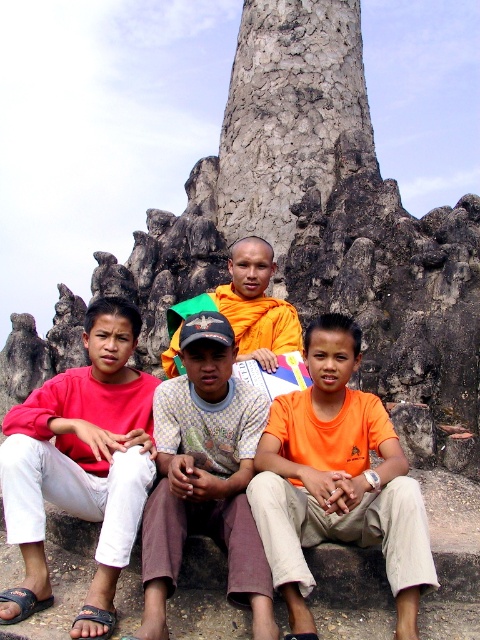
Which of these two, light brown cotton shirt at center or orange cloth at center, stands taller?

With more height is light brown cotton shirt at center.

Can you confirm if light brown cotton shirt at center is bigger than orange cloth at center?

No.

Where is `light brown cotton shirt at center`? light brown cotton shirt at center is located at coordinates (204, 476).

Image resolution: width=480 pixels, height=640 pixels. Identify the location of light brown cotton shirt at center. (204, 476).

How far apart are matte red shirt at left and orange cloth at center?

matte red shirt at left and orange cloth at center are 12.20 meters apart.

Is matte red shirt at left taller than orange cloth at center?

Indeed, matte red shirt at left has a greater height compared to orange cloth at center.

Is point (13, 456) less distant than point (277, 307)?

That is True.

Locate an element on the screen. The width and height of the screenshot is (480, 640). matte red shirt at left is located at coordinates (81, 465).

Identify the location of orange cotton shirt at center. This screenshot has width=480, height=640. (336, 481).

Is orange cotton shirt at center thinner than light brown cotton shirt at center?

No, orange cotton shirt at center is not thinner than light brown cotton shirt at center.

Identify the location of orange cotton shirt at center. The image size is (480, 640). (336, 481).

You are a GUI agent. You are given a task and a screenshot of the screen. Output one action in this format:
    pyautogui.click(x=<x>, y=<y>)
    Task: Click on the orange cotton shirt at center
    This screenshot has width=480, height=640.
    Given the screenshot: What is the action you would take?
    pyautogui.click(x=336, y=481)